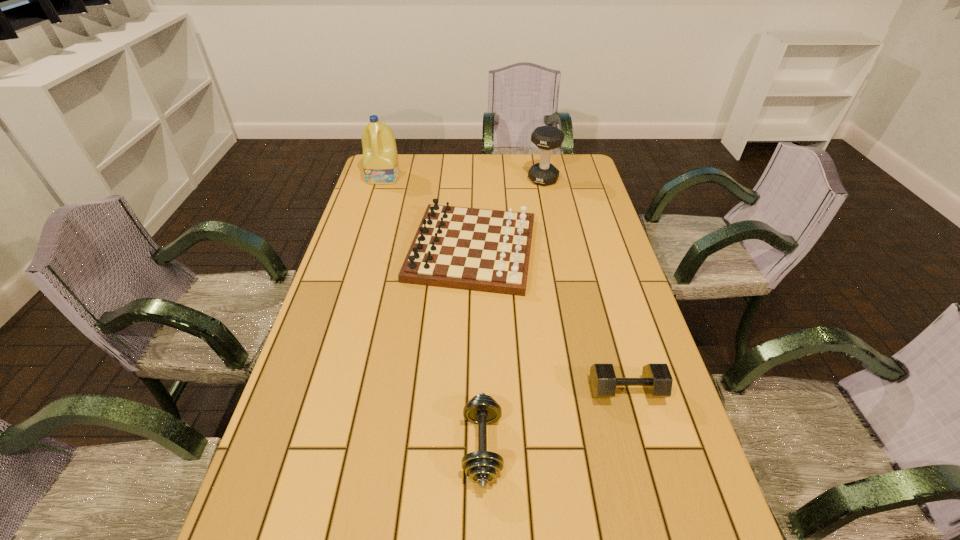
The height and width of the screenshot is (540, 960). Identify the location of detergent present at the far edge. (380, 159).

Find the location of a particular element. dumbbell located at the far edge is located at coordinates [x=546, y=138].

Where is `object that is at the left edge`? Image resolution: width=960 pixels, height=540 pixels. object that is at the left edge is located at coordinates (380, 159).

Identify the location of object positioned at the far left corner. (380, 159).

Find the location of a particular element. object that is positioned at the far right corner is located at coordinates (x=546, y=138).

The height and width of the screenshot is (540, 960). In the image, there is a desktop. What are the coordinates of `vacant space at the far edge` in the screenshot? It's located at (425, 158).

I want to click on vacant space at the left edge of the desktop, so click(x=370, y=221).

Locate an element on the screen. vacant area at the right edge is located at coordinates 688,511.

In the image, there is a desktop. At what (x,y) coordinates should I click in order to perform the action: click on vacant space at the far right corner. Please return your answer as a coordinate pair (x, y). The height and width of the screenshot is (540, 960). Looking at the image, I should click on (577, 168).

Identify which object is the fourth nearest to the leftmost dumbbell. Please provide its 2D coordinates. Your answer should be formatted as a tuple, i.e. [(x, y)], where the tuple contains the x and y coordinates of a point satisfying the conditions above.

[(380, 159)]